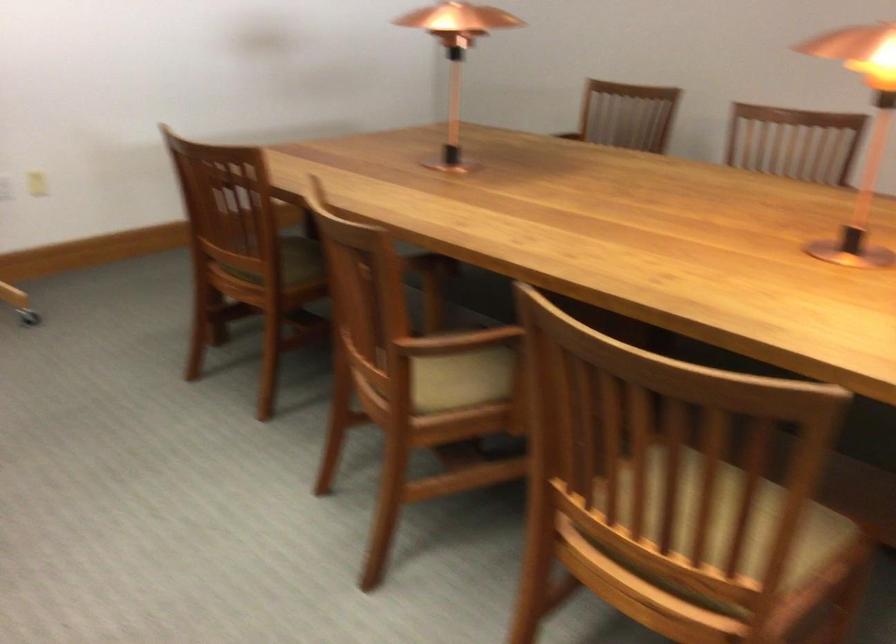
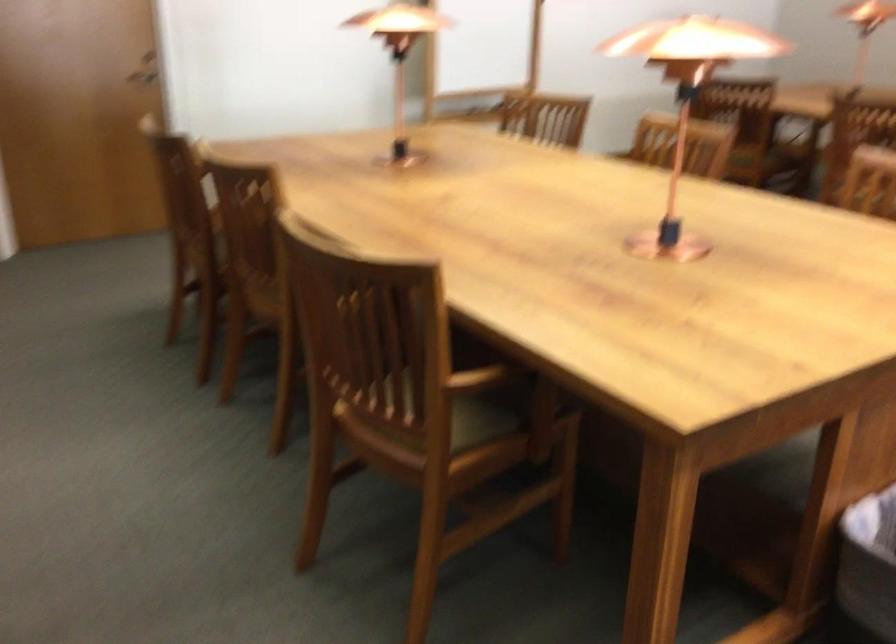
Which direction would the cameraman need to move to produce the second image?

The cameraman moved toward left, backward.